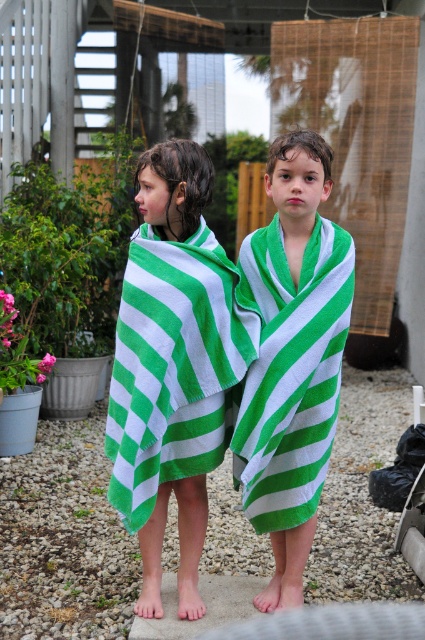
Which is below, green striped towel at left or green striped towel at center?

green striped towel at left

Who is more forward, (170, 170) or (311, 508)?

Point (170, 170) is in front.

Find the location of a particular element. green striped towel at left is located at coordinates (172, 365).